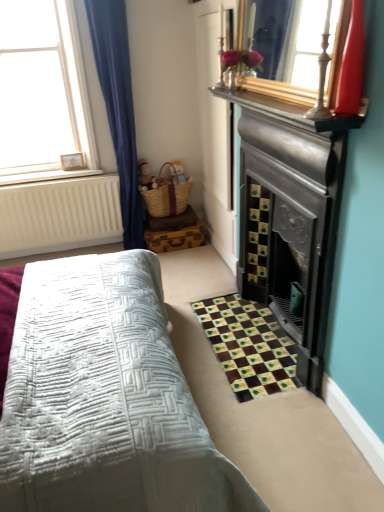
The width and height of the screenshot is (384, 512). What are the coordinates of `vacant area on top of brown fabric rug at lower right (from a real-world perspective)` in the screenshot? It's located at (246, 328).